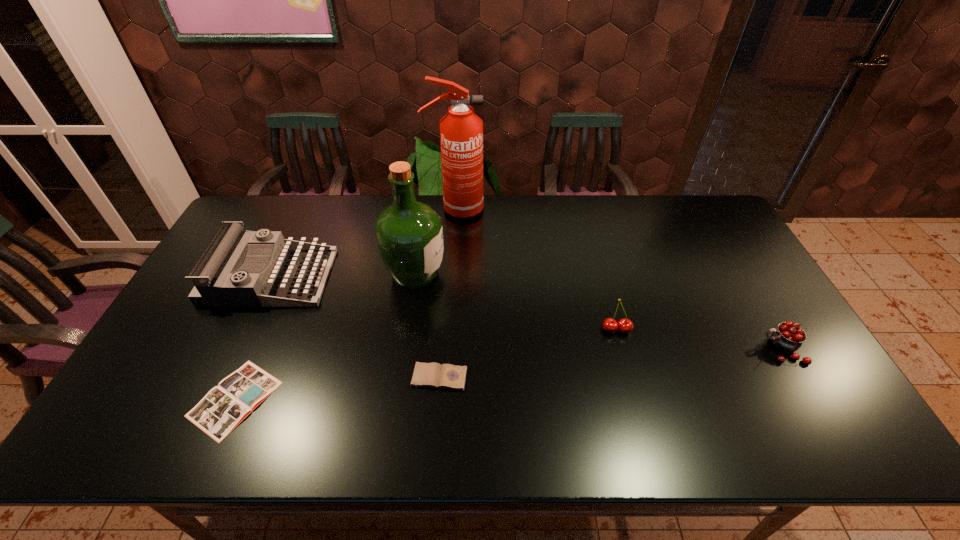
The image size is (960, 540). I want to click on fire extinguisher, so click(461, 131).

Image resolution: width=960 pixels, height=540 pixels. In order to click on the farthest object in this screenshot , I will do `click(461, 131)`.

Identify the location of liquor. The image size is (960, 540). (409, 234).

This screenshot has width=960, height=540. Find the location of `typewriter`. typewriter is located at coordinates (215, 285).

What are the coordinates of `the left cherry` in the screenshot? It's located at (610, 325).

Locate an element on the screen. This screenshot has width=960, height=540. the right cherry is located at coordinates (788, 337).

This screenshot has height=540, width=960. I want to click on the sixth tallest object, so click(x=447, y=376).

Locate an element on the screen. book is located at coordinates (224, 407).

Where is `free spot located 0.400m at the nozzle of the tallest object`? free spot located 0.400m at the nozzle of the tallest object is located at coordinates (593, 210).

Locate an element on the screen. The height and width of the screenshot is (540, 960). vacant space located 0.330m on the front-facing side of the liquor is located at coordinates (552, 274).